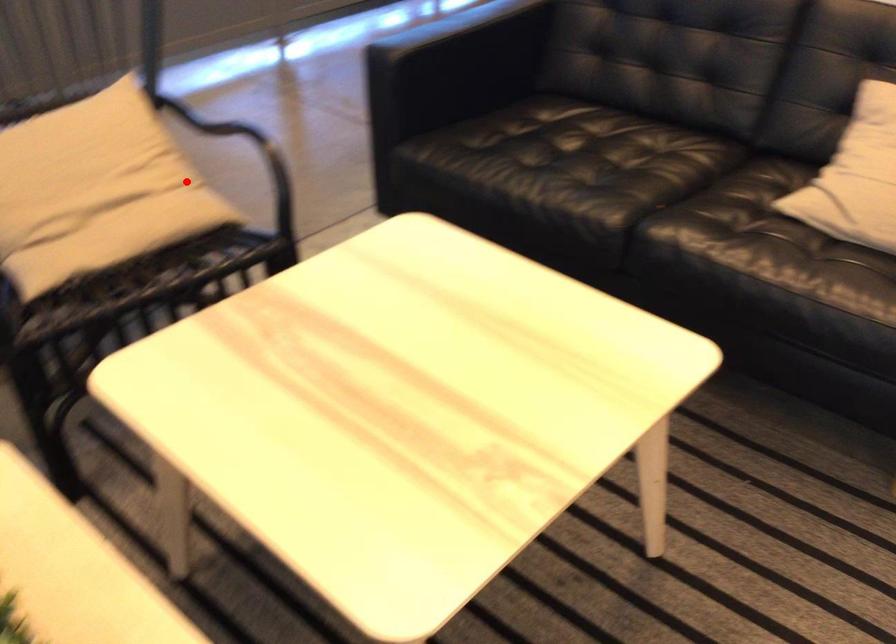
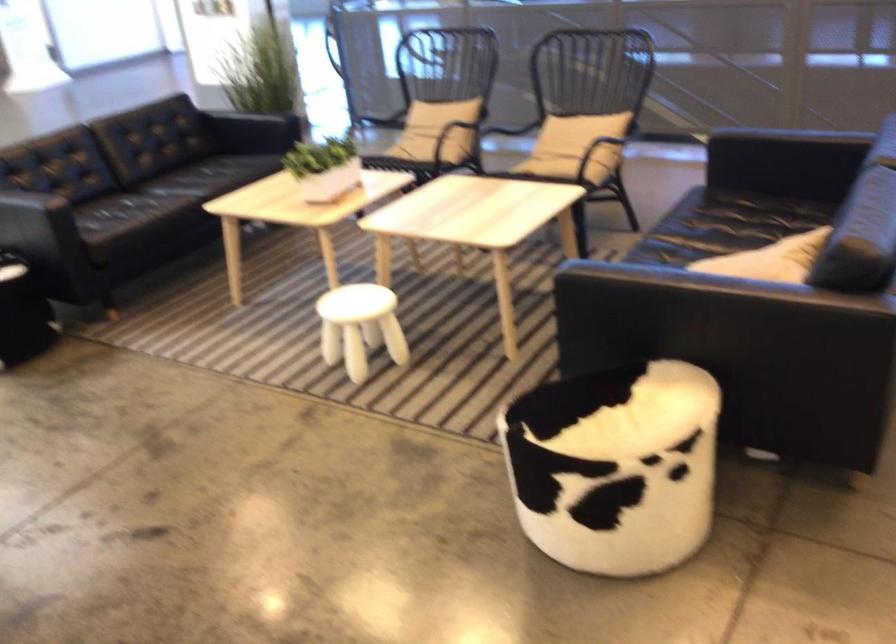
Question: I am providing you with two images of the same scene from different viewpoints. Given a red point in image1, look at the same physical point in image2. Is it:

Choices:
 (A) Closer to the viewpoint
 (B) Farther from the viewpoint

Answer: (B)